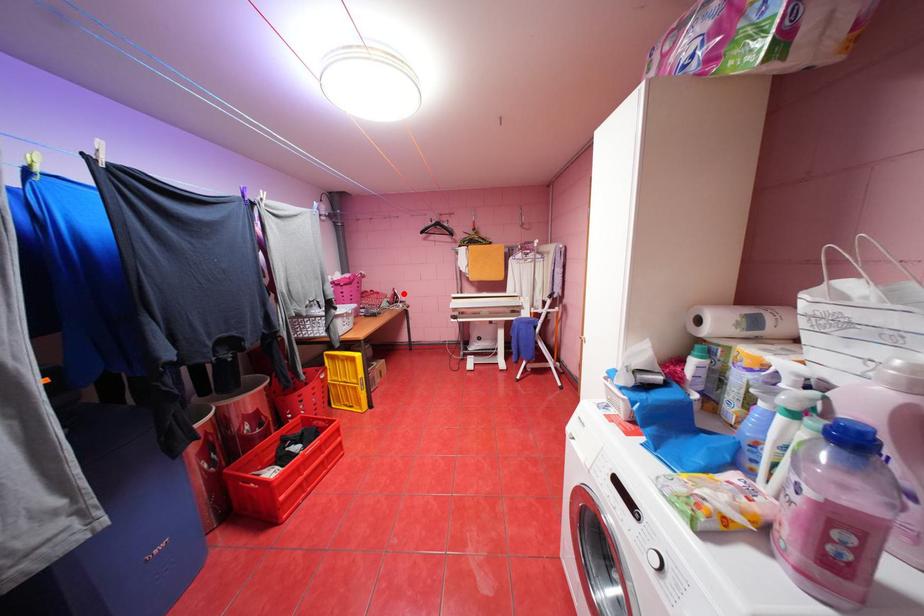
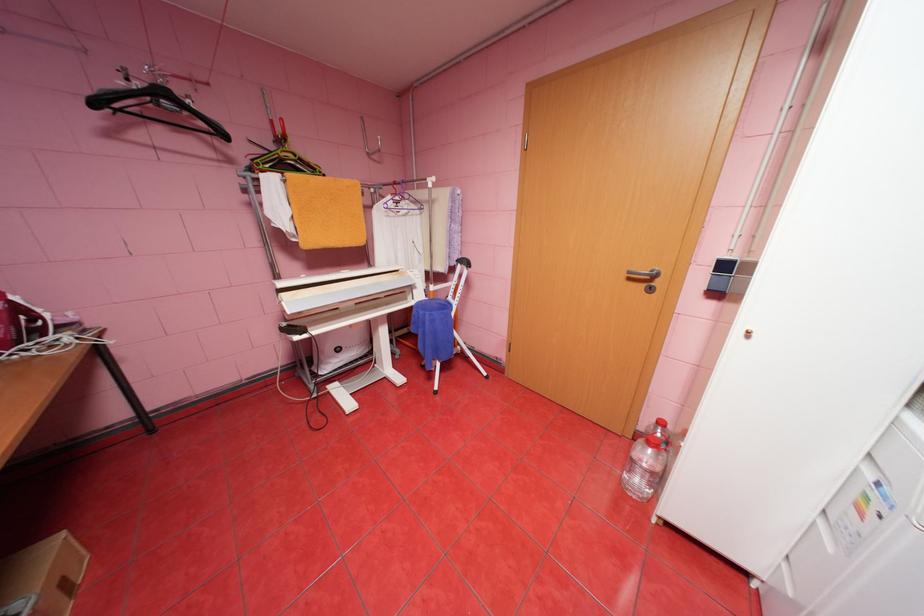
Question: I am providing you with two images of the same scene from different viewpoints. Given a red point in image1, look at the same physical point in image2. Is it:

Choices:
 (A) Closer to the viewpoint
 (B) Farther from the viewpoint

Answer: (B)